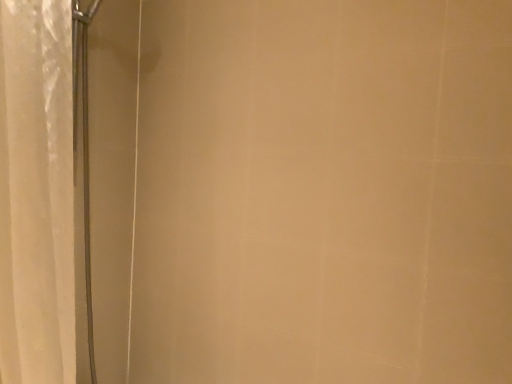
What do you see at coordinates (37, 194) in the screenshot? The height and width of the screenshot is (384, 512). I see `white translucent curtain at left` at bounding box center [37, 194].

What is the approximate width of white translucent curtain at left?

white translucent curtain at left is 14.09 inches wide.

Image resolution: width=512 pixels, height=384 pixels. In order to click on white translucent curtain at left in this screenshot , I will do `click(37, 194)`.

Where is `white translucent curtain at left`? white translucent curtain at left is located at coordinates (37, 194).